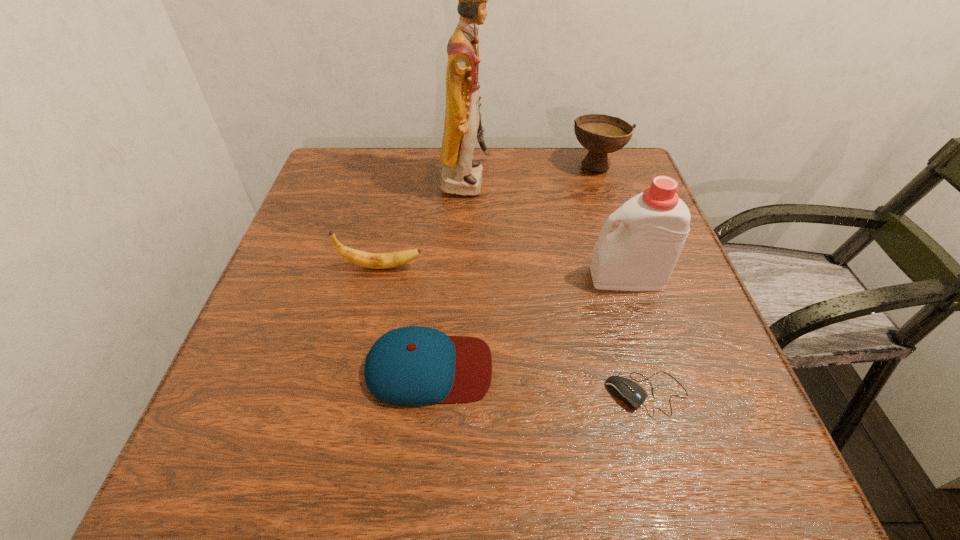
Where is `vacant space located on the left of the third tallest object`? vacant space located on the left of the third tallest object is located at coordinates (525, 165).

At what (x,y) coordinates should I click in order to perform the action: click on vacant space located 0.370m on the peel of the banana from the top. Please return your answer as a coordinate pair (x, y). Looking at the image, I should click on (606, 267).

Identify the location of vacant space located with the bill of the fifth tallest object facing forward. This screenshot has width=960, height=540. (709, 368).

Image resolution: width=960 pixels, height=540 pixels. I want to click on blank space located on the front of the computer mouse, so click(x=670, y=471).

Find the location of a particular element. Image resolution: width=960 pixels, height=540 pixels. nutcracker positioned at the far edge is located at coordinates (461, 175).

The width and height of the screenshot is (960, 540). In order to click on soup bowl that is at the far edge in this screenshot , I will do `click(601, 134)`.

Identify the location of object that is at the left edge. The height and width of the screenshot is (540, 960). (364, 259).

Image resolution: width=960 pixels, height=540 pixels. What are the coordinates of `detergent at the right edge` in the screenshot? It's located at (640, 255).

Identify the location of soup bowl that is at the right edge. (601, 134).

Identify the location of computer mouse that is positioned at the right edge. The height and width of the screenshot is (540, 960). (632, 394).